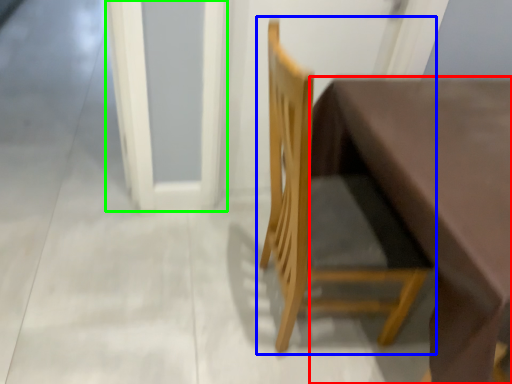
Question: Considering the real-world distances, which object is farthest from table (highlighted by a red box)? chair (highlighted by a blue box) or screen door (highlighted by a green box)?

Choices:
 (A) chair
 (B) screen door

Answer: (B)